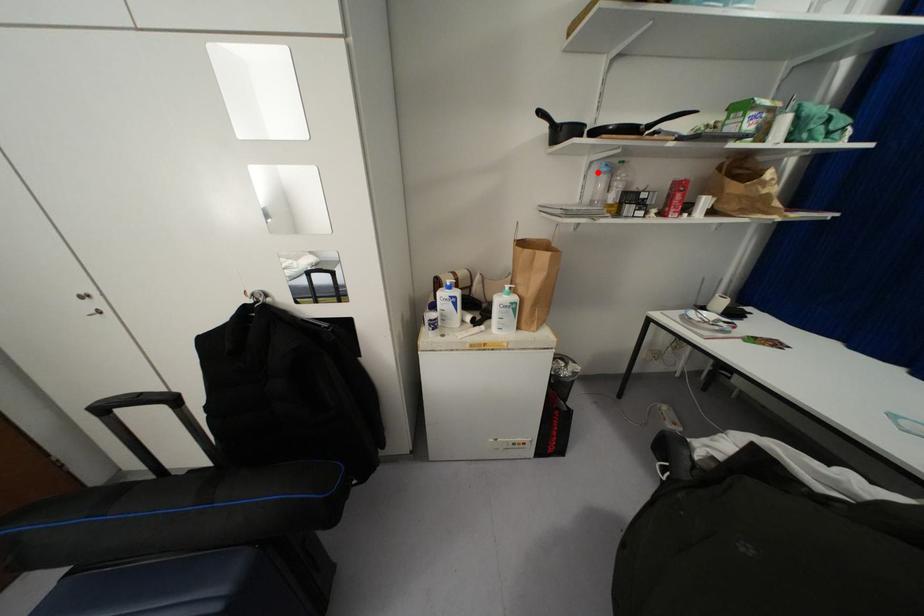
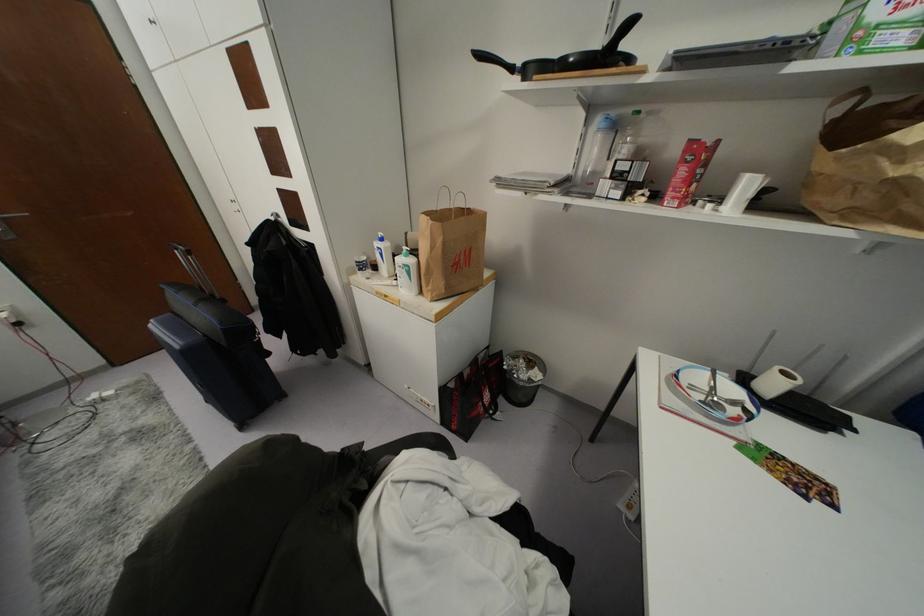
Where in the second image is the point corresponding to the highlighted location from the first image?

(599, 130)